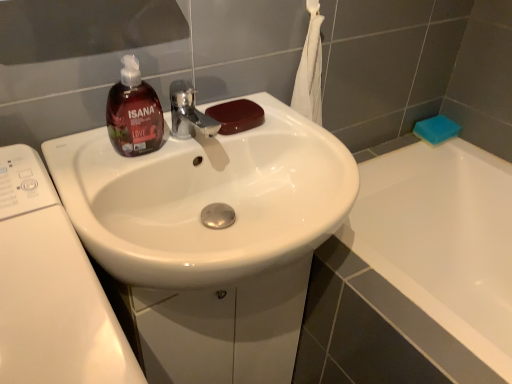
The width and height of the screenshot is (512, 384). Describe the element at coordinates (237, 116) in the screenshot. I see `brown glossy soap at sink, which is the 1th soap in front-to-back order` at that location.

Locate an element on the screen. white glossy washing machine at left is located at coordinates (51, 289).

Image resolution: width=512 pixels, height=384 pixels. Describe the element at coordinates (51, 289) in the screenshot. I see `white glossy washing machine at left` at that location.

This screenshot has height=384, width=512. I want to click on brown glossy soap at sink, marked as the second soap in a back-to-front arrangement, so click(x=237, y=116).

From the image's perspective, between white glossy sink at center and white glossy washing machine at left, which one is located above?

white glossy sink at center.

Is white glossy sink at center in front of or behind white glossy washing machine at left in the image?

Clearly, white glossy sink at center is behind white glossy washing machine at left.

Is white glossy sink at center turned away from white glossy washing machine at left?

No, white glossy sink at center's orientation is not away from white glossy washing machine at left.

Is brown matte liquid soap at upper left smaller than blue sponge at upper right, which appears as the 2th soap when viewed from the left?

No.

Would you say brown matte liquid soap at upper left contains blue sponge at upper right, acting as the second soap starting from the front?

No, blue sponge at upper right, acting as the second soap starting from the front, is not surrounded by brown matte liquid soap at upper left.

Does brown matte liquid soap at upper left have a greater height compared to blue sponge at upper right, acting as the second soap starting from the front?

Correct, brown matte liquid soap at upper left is much taller as blue sponge at upper right, acting as the second soap starting from the front.

Does brown matte liquid soap at upper left touch blue sponge at upper right, which appears as the 2th soap when viewed from the left?

No.

Which is in front, point (451, 123) or point (87, 270)?

Point (87, 270)

Is blue sponge at upper right, placed as the 1th soap when sorted from back to front, bigger than white glossy washing machine at left?

Incorrect, blue sponge at upper right, placed as the 1th soap when sorted from back to front, is not larger than white glossy washing machine at left.

Is blue sponge at upper right, acting as the second soap starting from the front, behind white glossy washing machine at left?

Yes, it is behind white glossy washing machine at left.

From the image's perspective, which one is positioned lower, brown matte liquid soap at upper left or white glossy washing machine at left?

white glossy washing machine at left, from the image's perspective.

Considering the sizes of objects brown matte liquid soap at upper left and white glossy washing machine at left in the image provided, who is taller, brown matte liquid soap at upper left or white glossy washing machine at left?

white glossy washing machine at left.

Is brown matte liquid soap at upper left outside of white glossy washing machine at left?

Indeed, brown matte liquid soap at upper left is completely outside white glossy washing machine at left.

At what (x,y) coordinates should I click in order to perform the action: click on bottle on the right of the white glossy washing machine at left. Please return your answer as a coordinate pair (x, y). Looking at the image, I should click on (134, 113).

What's the angular difference between brown glossy soap at sink, which is the 1th soap in front-to-back order, and brown matte liquid soap at upper left's facing directions?

0.824 degrees separate the facing orientations of brown glossy soap at sink, which is the 1th soap in front-to-back order, and brown matte liquid soap at upper left.

Is brown glossy soap at sink, which is the 1th soap in front-to-back order, positioned in front of brown matte liquid soap at upper left?

No, it is behind brown matte liquid soap at upper left.

Would you say brown matte liquid soap at upper left is part of brown glossy soap at sink, arranged as the 2th soap when viewed from the right,'s contents?

No, brown glossy soap at sink, arranged as the 2th soap when viewed from the right, does not contain brown matte liquid soap at upper left.

Could you measure the distance between brown glossy soap at sink, arranged as the 2th soap when viewed from the right, and brown matte liquid soap at upper left?

They are 6.51 inches apart.

Is point (426, 138) behind point (237, 110)?

Yes, it is behind point (237, 110).

Which is behind, blue sponge at upper right, placed as the 1th soap when sorted from back to front, or brown glossy soap at sink, marked as the second soap in a back-to-front arrangement?

blue sponge at upper right, placed as the 1th soap when sorted from back to front, is further away from the camera.

Does blue sponge at upper right, acting as the second soap starting from the front, have a larger size compared to brown glossy soap at sink, which is the 1th soap in front-to-back order?

Yes.

Between white glossy sink at center and brown matte liquid soap at upper left, which one is positioned behind?

brown matte liquid soap at upper left is more distant.

How far apart are white glossy sink at center and brown matte liquid soap at upper left?

7.10 inches.

Looking at this image, from the image's perspective, which object appears higher, white glossy sink at center or brown matte liquid soap at upper left?

brown matte liquid soap at upper left is shown above in the image.

Is there a large distance between white glossy sink at center and brown matte liquid soap at upper left?

white glossy sink at center is actually quite close to brown matte liquid soap at upper left.

You are a GUI agent. You are given a task and a screenshot of the screen. Output one action in this format:
    pyautogui.click(x=<x>, y=<y>)
    Task: Click on the sink that appears behind the white glossy washing machine at left
    Image resolution: width=512 pixels, height=384 pixels.
    Given the screenshot: What is the action you would take?
    pyautogui.click(x=206, y=199)

Find the location of a particular element. bottle below the blue sponge at upper right, which appears as the 2th soap when viewed from the left (from the image's perspective) is located at coordinates (134, 113).

Which object lies further to the anchor point white glossy sink at center, white glossy washing machine at left or blue sponge at upper right, placed as the 1th soap when sorted from back to front?

The object further to white glossy sink at center is blue sponge at upper right, placed as the 1th soap when sorted from back to front.

Based on their spatial positions, is blue sponge at upper right, the 1th soap from the right, or white glossy washing machine at left closer to white glossy sink at center?

white glossy washing machine at left lies closer to white glossy sink at center than the other object.

When comparing their distances from blue sponge at upper right, the 1th soap from the right, does brown matte liquid soap at upper left or white glossy washing machine at left seem further?

white glossy washing machine at left is positioned further to the anchor blue sponge at upper right, the 1th soap from the right.

Looking at the image, which one is located further to blue sponge at upper right, which appears as the 2th soap when viewed from the left, brown glossy soap at sink, which is the 1th soap in front-to-back order, or white glossy washing machine at left?

The object further to blue sponge at upper right, which appears as the 2th soap when viewed from the left, is white glossy washing machine at left.

Estimate the real-world distances between objects in this image. Which object is further from brown glossy soap at sink, placed as the first soap when sorted from left to right, brown matte liquid soap at upper left or blue sponge at upper right, placed as the 1th soap when sorted from back to front?

Based on the image, blue sponge at upper right, placed as the 1th soap when sorted from back to front, appears to be further to brown glossy soap at sink, placed as the first soap when sorted from left to right.

Looking at the image, which one is located closer to blue sponge at upper right, the 1th soap from the right, white glossy sink at center or white glossy washing machine at left?

Among the two, white glossy sink at center is located nearer to blue sponge at upper right, the 1th soap from the right.

Estimate the real-world distances between objects in this image. Which object is closer to white glossy sink at center, blue sponge at upper right, acting as the second soap starting from the front, or brown matte liquid soap at upper left?

brown matte liquid soap at upper left is closer to white glossy sink at center.

When comparing their distances from white glossy washing machine at left, does brown glossy soap at sink, arranged as the 2th soap when viewed from the right, or white glossy sink at center seem closer?

white glossy sink at center.

What are the coordinates of `sink that lies between brown matte liquid soap at upper left and white glossy washing machine at left from top to bottom` in the screenshot? It's located at (206, 199).

Locate an element on the screen. This screenshot has height=384, width=512. bottle between white glossy sink at center and brown glossy soap at sink, marked as the second soap in a back-to-front arrangement, from front to back is located at coordinates (134, 113).

You are a GUI agent. You are given a task and a screenshot of the screen. Output one action in this format:
    pyautogui.click(x=<x>, y=<y>)
    Task: Click on the bottle between white glossy washing machine at left and blue sponge at upper right, the 1th soap from the right, along the z-axis
    The height and width of the screenshot is (384, 512).
    Given the screenshot: What is the action you would take?
    pyautogui.click(x=134, y=113)

Identify the location of bottle between brown glossy soap at sink, placed as the first soap when sorted from left to right, and white glossy washing machine at left from top to bottom. (134, 113).